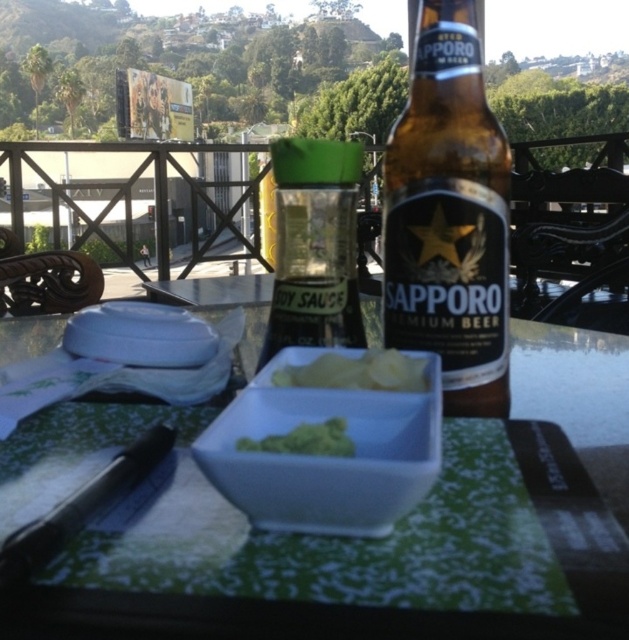
Question: Which object is positioned farthest from the brown glass beer bottle at center?

Choices:
 (A) green plastic soy sauce bottle at center
 (B) green matte vegetable at center
 (C) white plastic bowl at center

Answer: (B)

Question: Is brown glass beer bottle at center to the right of yellow creamy dip at center from the viewer's perspective?

Choices:
 (A) no
 (B) yes

Answer: (B)

Question: Can you confirm if white plastic bowl at center is positioned below green plastic soy sauce bottle at center?

Choices:
 (A) yes
 (B) no

Answer: (A)

Question: Estimate the real-world distances between objects in this image. Which object is closer to the green matte vegetable at center?

Choices:
 (A) brown glass beer bottle at center
 (B) white glossy table at center

Answer: (B)

Question: Is green plastic soy sauce bottle at center positioned at the back of green matte vegetable at center?

Choices:
 (A) yes
 (B) no

Answer: (A)

Question: Which of the following is the closest to the observer?

Choices:
 (A) green matte vegetable at center
 (B) white plastic bowl at center
 (C) yellow creamy dip at center
 (D) white glossy table at center

Answer: (D)